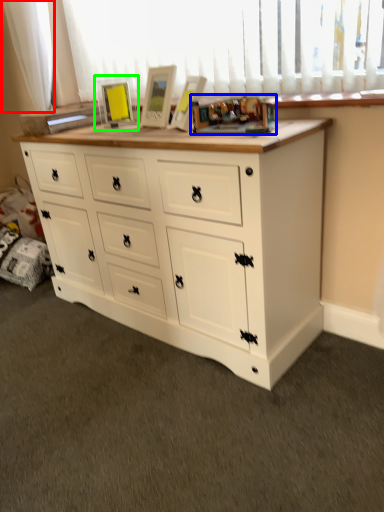
Question: Which is nearer to the curtain (highlighted by a red box)? toy (highlighted by a blue box) or picture frame (highlighted by a green box).

Choices:
 (A) toy
 (B) picture frame

Answer: (B)